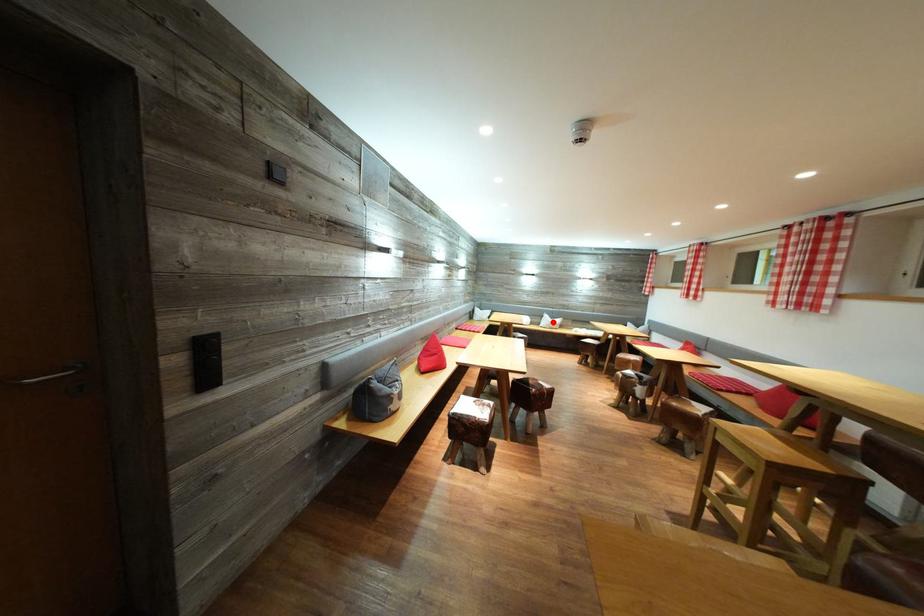
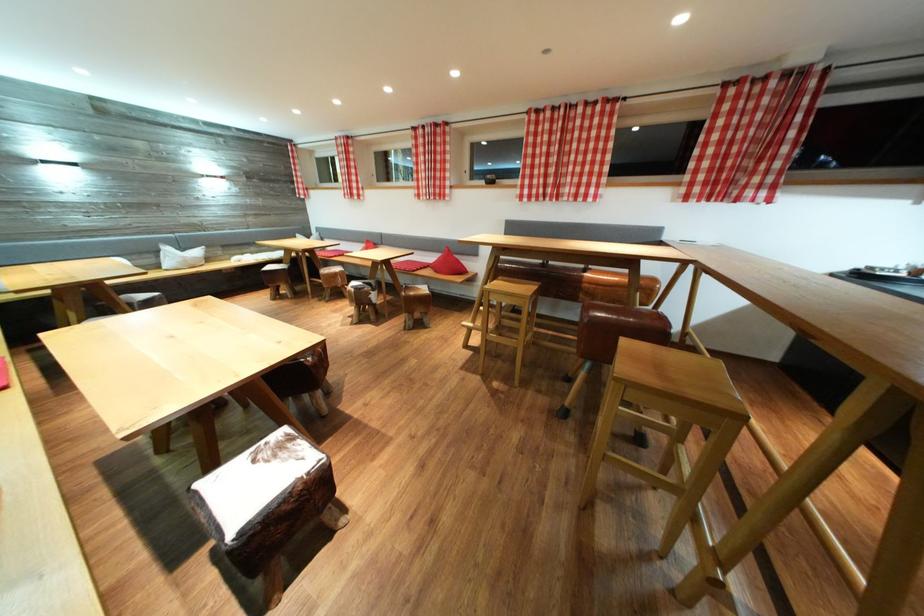
The point at the highlighted location is marked in the first image. Where is the corresponding point in the second image?

(176, 254)